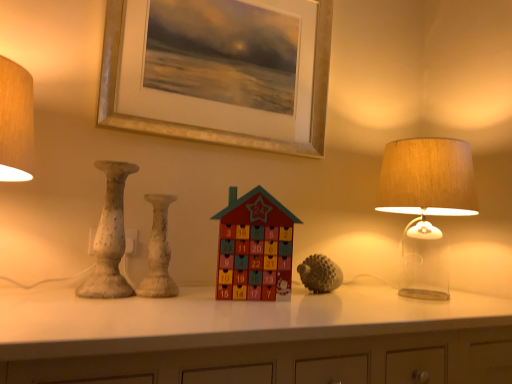
At what (x,y) coordinates should I click in order to perform the action: click on gold metallic picture frame at upper center. Please return your answer as a coordinate pair (x, y). Image resolution: width=512 pixels, height=384 pixels. Looking at the image, I should click on (x=208, y=128).

The width and height of the screenshot is (512, 384). What do you see at coordinates (255, 248) in the screenshot?
I see `wooden advent calendar at center, which ranks as the second toy in back-to-front order` at bounding box center [255, 248].

Where is `textured gray hedgehog at center, positioned as the second toy in front-to-back order`? The height and width of the screenshot is (384, 512). textured gray hedgehog at center, positioned as the second toy in front-to-back order is located at coordinates (320, 274).

Considering the sizes of objects wooden advent calendar at center, which is counted as the 1th toy, starting from the left, and textured gray hedgehog at center, placed as the 1th toy when sorted from back to front, in the image provided, who is thinner, wooden advent calendar at center, which is counted as the 1th toy, starting from the left, or textured gray hedgehog at center, placed as the 1th toy when sorted from back to front,?

Thinner between the two is wooden advent calendar at center, which is counted as the 1th toy, starting from the left.

Are wooden advent calendar at center, the second toy from the right, and textured gray hedgehog at center, positioned as the first toy in right-to-left order, located far from each other?

No, there isn't a large distance between wooden advent calendar at center, the second toy from the right, and textured gray hedgehog at center, positioned as the first toy in right-to-left order.

Is wooden advent calendar at center, acting as the first toy starting from the front, facing away from textured gray hedgehog at center, positioned as the second toy in front-to-back order?

No.

Between wooden advent calendar at center, the second toy from the right, and textured gray hedgehog at center, placed as the 1th toy when sorted from back to front, which one is positioned in front?

wooden advent calendar at center, the second toy from the right, is closer to the camera.

Considering the sizes of objects gold metallic picture frame at upper center and wooden advent calendar at center, the second toy from the right, in the image provided, who is bigger, gold metallic picture frame at upper center or wooden advent calendar at center, the second toy from the right,?

gold metallic picture frame at upper center is bigger.

Looking at this image, does gold metallic picture frame at upper center have a greater width compared to wooden advent calendar at center, which ranks as the second toy in back-to-front order?

Yes, gold metallic picture frame at upper center is wider than wooden advent calendar at center, which ranks as the second toy in back-to-front order.

Which of these two, gold metallic picture frame at upper center or wooden advent calendar at center, which ranks as the second toy in back-to-front order, stands taller?

With more height is gold metallic picture frame at upper center.

From the image's perspective, is gold metallic picture frame at upper center below wooden advent calendar at center, the second toy from the right?

Actually, gold metallic picture frame at upper center appears above wooden advent calendar at center, the second toy from the right, in the image.

Looking at the image, does textured gray hedgehog at center, positioned as the first toy in right-to-left order, seem bigger or smaller compared to white speckled vase at center, which appears as the second vase when viewed from the left?

Clearly, textured gray hedgehog at center, positioned as the first toy in right-to-left order, is smaller in size than white speckled vase at center, which appears as the second vase when viewed from the left.

Does textured gray hedgehog at center, placed as the 1th toy when sorted from back to front, lie behind white speckled vase at center, placed as the first vase when sorted from right to left?

Yes, textured gray hedgehog at center, placed as the 1th toy when sorted from back to front, is further from the camera.

Where is `toy that appears below the white speckled vase at center, which appears as the second vase when viewed from the left (from the image's perspective)`? toy that appears below the white speckled vase at center, which appears as the second vase when viewed from the left (from the image's perspective) is located at coordinates (320, 274).

From a real-world perspective, is textured gray hedgehog at center, the 2th toy viewed from the left, located higher than white speckled vase at center, placed as the first vase when sorted from right to left?

No.

Consider the image. Could you measure the distance between translucent glass lampshade at right and wooden advent calendar at center, acting as the first toy starting from the front?

They are 23.24 inches apart.

From a real-world perspective, is translucent glass lampshade at right positioned above or below wooden advent calendar at center, which ranks as the second toy in back-to-front order?

translucent glass lampshade at right is situated higher than wooden advent calendar at center, which ranks as the second toy in back-to-front order, in the real world.

How different are the orientations of translucent glass lampshade at right and wooden advent calendar at center, acting as the first toy starting from the front, in degrees?

The angle between the facing direction of translucent glass lampshade at right and the facing direction of wooden advent calendar at center, acting as the first toy starting from the front, is 14 degrees.

Is translucent glass lampshade at right looking in the opposite direction of wooden advent calendar at center, which is counted as the 1th toy, starting from the left?

No, wooden advent calendar at center, which is counted as the 1th toy, starting from the left, is not at the back of translucent glass lampshade at right.

Considering the sizes of white speckled vase at center, which appears as the second vase when viewed from the left, and textured gray hedgehog at center, positioned as the first toy in right-to-left order, in the image, is white speckled vase at center, which appears as the second vase when viewed from the left, taller or shorter than textured gray hedgehog at center, positioned as the first toy in right-to-left order,?

white speckled vase at center, which appears as the second vase when viewed from the left, is taller than textured gray hedgehog at center, positioned as the first toy in right-to-left order.

From the image's perspective, which one is positioned lower, white speckled vase at center, which appears as the second vase when viewed from the left, or textured gray hedgehog at center, placed as the 1th toy when sorted from back to front?

textured gray hedgehog at center, placed as the 1th toy when sorted from back to front, is shown below in the image.

From the picture: Would you consider white speckled vase at center, placed as the first vase when sorted from right to left, to be distant from textured gray hedgehog at center, placed as the 1th toy when sorted from back to front?

No, there isn't a large distance between white speckled vase at center, placed as the first vase when sorted from right to left, and textured gray hedgehog at center, placed as the 1th toy when sorted from back to front.

Does white speckled vase at center, placed as the first vase when sorted from right to left, have a greater width compared to textured gray hedgehog at center, positioned as the second toy in front-to-back order?

In fact, white speckled vase at center, placed as the first vase when sorted from right to left, might be narrower than textured gray hedgehog at center, positioned as the second toy in front-to-back order.

Is wooden advent calendar at center, acting as the first toy starting from the front, far from speckled ceramic vase at left, positioned as the first vase in left-to-right order?

wooden advent calendar at center, acting as the first toy starting from the front, is near speckled ceramic vase at left, positioned as the first vase in left-to-right order, not far away.

Could you tell me if wooden advent calendar at center, which is counted as the 1th toy, starting from the left, is facing speckled ceramic vase at left, marked as the 2th vase in a right-to-left arrangement?

No, wooden advent calendar at center, which is counted as the 1th toy, starting from the left, is not oriented towards speckled ceramic vase at left, marked as the 2th vase in a right-to-left arrangement.

Considering the sizes of objects wooden advent calendar at center, the second toy from the right, and speckled ceramic vase at left, marked as the 2th vase in a right-to-left arrangement, in the image provided, who is thinner, wooden advent calendar at center, the second toy from the right, or speckled ceramic vase at left, marked as the 2th vase in a right-to-left arrangement,?

wooden advent calendar at center, the second toy from the right.

From a real-world perspective, who is located lower, wooden advent calendar at center, which is counted as the 1th toy, starting from the left, or speckled ceramic vase at left, marked as the 2th vase in a right-to-left arrangement?

wooden advent calendar at center, which is counted as the 1th toy, starting from the left, is physically lower.

Do you think translucent glass lampshade at right is within white speckled vase at center, which appears as the second vase when viewed from the left, or outside of it?

translucent glass lampshade at right exists outside the volume of white speckled vase at center, which appears as the second vase when viewed from the left.

Can you confirm if translucent glass lampshade at right is positioned to the right of white speckled vase at center, which appears as the second vase when viewed from the left?

Indeed, translucent glass lampshade at right is positioned on the right side of white speckled vase at center, which appears as the second vase when viewed from the left.

Relative to white speckled vase at center, placed as the first vase when sorted from right to left, is translucent glass lampshade at right in front or behind?

Visually, translucent glass lampshade at right is located behind white speckled vase at center, placed as the first vase when sorted from right to left.

Does point (452, 140) lie behind point (150, 293)?

Yes, it is.

You are a GUI agent. You are given a task and a screenshot of the screen. Output one action in this format:
    pyautogui.click(x=<x>, y=<y>)
    Task: Click on the toy in front of the textured gray hedgehog at center, positioned as the second toy in front-to-back order
    
    Given the screenshot: What is the action you would take?
    pyautogui.click(x=255, y=248)

I want to click on picture frame behind the wooden advent calendar at center, acting as the first toy starting from the front, so click(208, 128).

Looking at the image, which one is located closer to wooden advent calendar at center, which ranks as the second toy in back-to-front order, white speckled vase at center, which appears as the second vase when viewed from the left, or speckled ceramic vase at left, positioned as the first vase in left-to-right order?

white speckled vase at center, which appears as the second vase when viewed from the left.

From the image, which object appears to be farther from wooden advent calendar at center, which ranks as the second toy in back-to-front order, textured gray hedgehog at center, positioned as the second toy in front-to-back order, or translucent glass lampshade at right?

translucent glass lampshade at right is further to wooden advent calendar at center, which ranks as the second toy in back-to-front order.

Looking at the image, which one is located closer to wooden advent calendar at center, acting as the first toy starting from the front, textured gray hedgehog at center, positioned as the first toy in right-to-left order, or speckled ceramic vase at left, positioned as the first vase in left-to-right order?

Among the two, textured gray hedgehog at center, positioned as the first toy in right-to-left order, is located nearer to wooden advent calendar at center, acting as the first toy starting from the front.

Estimate the real-world distances between objects in this image. Which object is closer to textured gray hedgehog at center, positioned as the second toy in front-to-back order, speckled ceramic vase at left, marked as the 2th vase in a right-to-left arrangement, or wooden advent calendar at center, the second toy from the right?

wooden advent calendar at center, the second toy from the right, is closer to textured gray hedgehog at center, positioned as the second toy in front-to-back order.

Estimate the real-world distances between objects in this image. Which object is further from wooden advent calendar at center, acting as the first toy starting from the front, gold metallic picture frame at upper center or white speckled vase at center, which appears as the second vase when viewed from the left?

→ gold metallic picture frame at upper center.

Considering their positions, is textured gray hedgehog at center, positioned as the first toy in right-to-left order, positioned further to wooden advent calendar at center, which is counted as the 1th toy, starting from the left, than gold metallic picture frame at upper center?

Among the two, gold metallic picture frame at upper center is located further to wooden advent calendar at center, which is counted as the 1th toy, starting from the left.

When comparing their distances from wooden advent calendar at center, the second toy from the right, does translucent glass lampshade at right or textured gray hedgehog at center, placed as the 1th toy when sorted from back to front, seem closer?

The object closer to wooden advent calendar at center, the second toy from the right, is textured gray hedgehog at center, placed as the 1th toy when sorted from back to front.

Based on their spatial positions, is white speckled vase at center, which appears as the second vase when viewed from the left, or translucent glass lampshade at right closer to speckled ceramic vase at left, marked as the 2th vase in a right-to-left arrangement?

Among the two, white speckled vase at center, which appears as the second vase when viewed from the left, is located nearer to speckled ceramic vase at left, marked as the 2th vase in a right-to-left arrangement.

The height and width of the screenshot is (384, 512). I want to click on picture frame between white speckled vase at center, which appears as the second vase when viewed from the left, and translucent glass lampshade at right, in the horizontal direction, so click(x=208, y=128).

Image resolution: width=512 pixels, height=384 pixels. What are the coordinates of `toy between speckled ceramic vase at left, marked as the 2th vase in a right-to-left arrangement, and textured gray hedgehog at center, positioned as the first toy in right-to-left order` in the screenshot? It's located at (255, 248).

This screenshot has height=384, width=512. I want to click on vase between gold metallic picture frame at upper center and white speckled vase at center, which appears as the second vase when viewed from the left, in the up-down direction, so click(x=109, y=238).

At what (x,y) coordinates should I click in order to perform the action: click on toy between white speckled vase at center, placed as the first vase when sorted from right to left, and textured gray hedgehog at center, positioned as the first toy in right-to-left order, from left to right. Please return your answer as a coordinate pair (x, y). The height and width of the screenshot is (384, 512). Looking at the image, I should click on (255, 248).